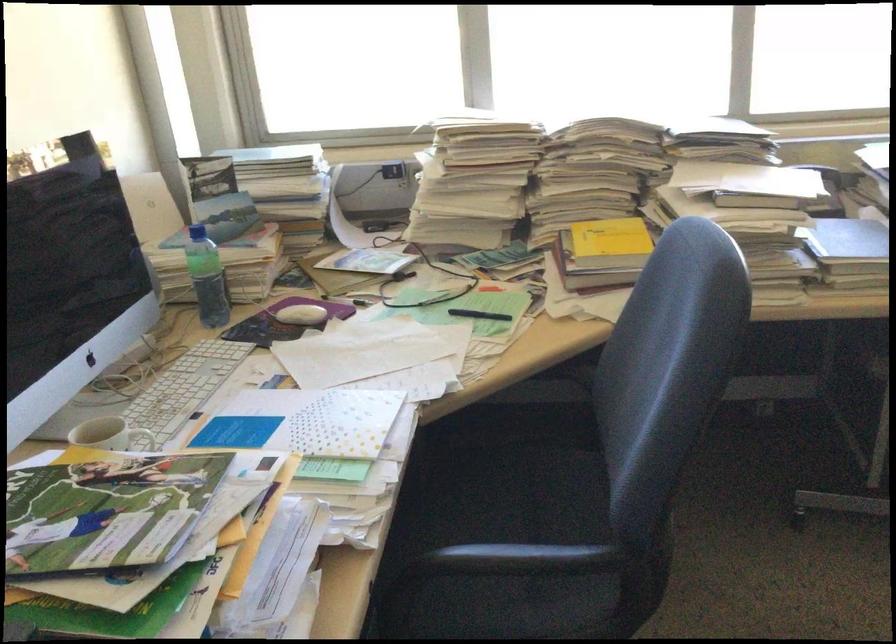
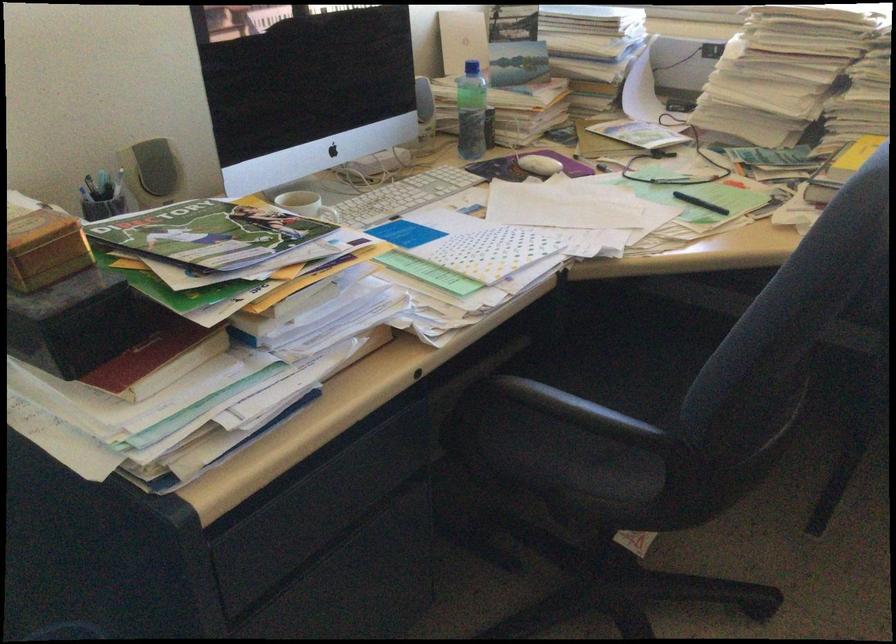
In the second image, find the point that corresponds to point (478, 317) in the first image.

(700, 203)